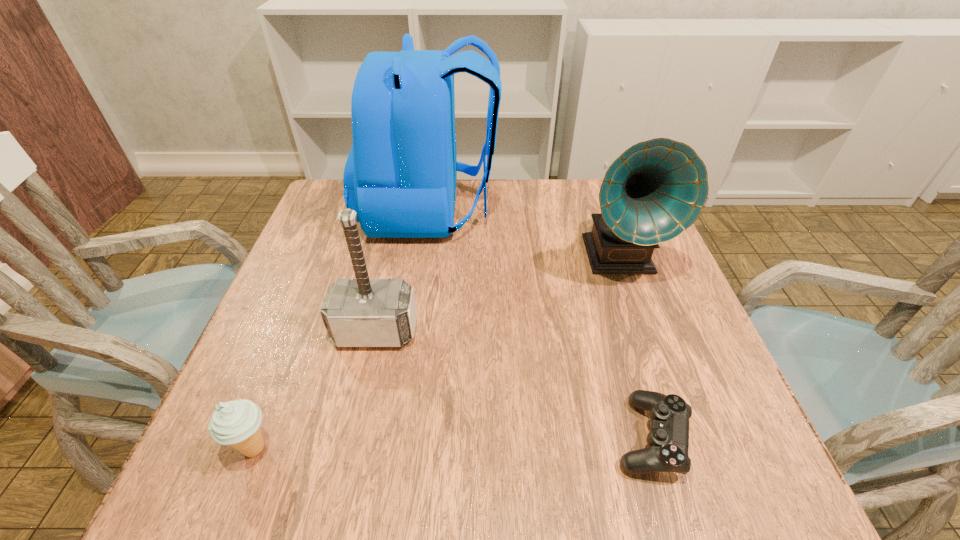
The height and width of the screenshot is (540, 960). What are the coordinates of `object situated at the far left corner` in the screenshot? It's located at (400, 176).

Where is `object located in the near left corner section of the desktop`? object located in the near left corner section of the desktop is located at coordinates (236, 423).

This screenshot has width=960, height=540. Find the location of `object that is positioned at the far right corner`. object that is positioned at the far right corner is located at coordinates (655, 190).

Find the location of `object present at the near right corner`. object present at the near right corner is located at coordinates (668, 440).

Identify the location of vacant space at the far edge of the desktop. The width and height of the screenshot is (960, 540). (558, 222).

You are a GUI agent. You are given a task and a screenshot of the screen. Output one action in this format:
    pyautogui.click(x=<x>, y=<y>)
    Task: Click on the vacant space at the near edge
    
    Given the screenshot: What is the action you would take?
    pyautogui.click(x=358, y=474)

In the image, there is a desktop. Where is `free space at the right edge`? The width and height of the screenshot is (960, 540). free space at the right edge is located at coordinates (652, 303).

Identify the location of vacant space at the far left corner of the desktop. (336, 218).

Identify the location of free point at the near right corner. The width and height of the screenshot is (960, 540). (701, 472).

Find the location of a particular element. This screenshot has width=960, height=540. free area in between the leftmost object and the third farthest object is located at coordinates (315, 390).